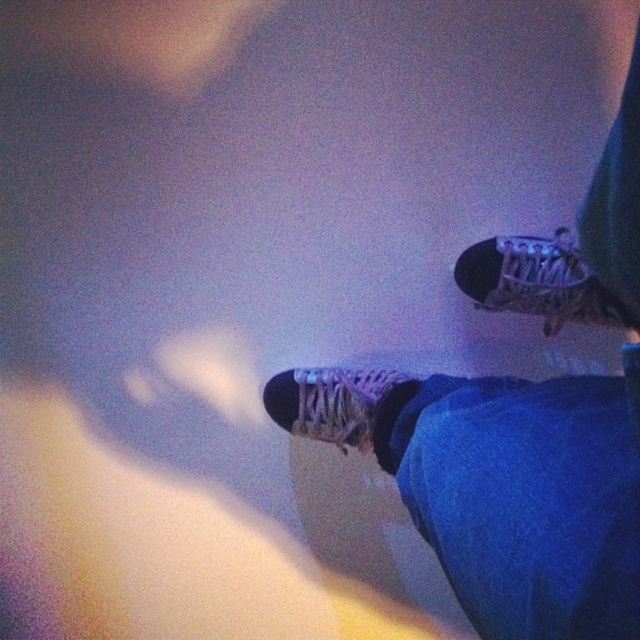
Is matte white sneaker at upper right positioned in front of matte white sneaker at center?

Yes, matte white sneaker at upper right is in front of matte white sneaker at center.

Does matte white sneaker at upper right have a greater width compared to matte white sneaker at center?

Yes, matte white sneaker at upper right is wider than matte white sneaker at center.

What do you see at coordinates (538, 282) in the screenshot? This screenshot has width=640, height=640. I see `matte white sneaker at upper right` at bounding box center [538, 282].

This screenshot has height=640, width=640. In order to click on matte white sneaker at upper right in this screenshot , I will do `click(538, 282)`.

Is point (502, 612) positioned in front of point (289, 432)?

Yes, it is.

Can you confirm if matte black skateboard at lower right is positioned below matte white sneaker at center?

Incorrect, matte black skateboard at lower right is not positioned below matte white sneaker at center.

Describe the element at coordinates (518, 428) in the screenshot. I see `matte black skateboard at lower right` at that location.

This screenshot has width=640, height=640. I want to click on matte black skateboard at lower right, so click(x=518, y=428).

Between matte black skateboard at lower right and matte white sneaker at upper right, which one is positioned higher?

matte white sneaker at upper right is higher up.

Is point (372, 403) positioned before point (460, 288)?

Yes, it is in front of point (460, 288).

At what (x,y) coordinates should I click in order to perform the action: click on matte black skateboard at lower right. Please return your answer as a coordinate pair (x, y). This screenshot has height=640, width=640. Looking at the image, I should click on (518, 428).